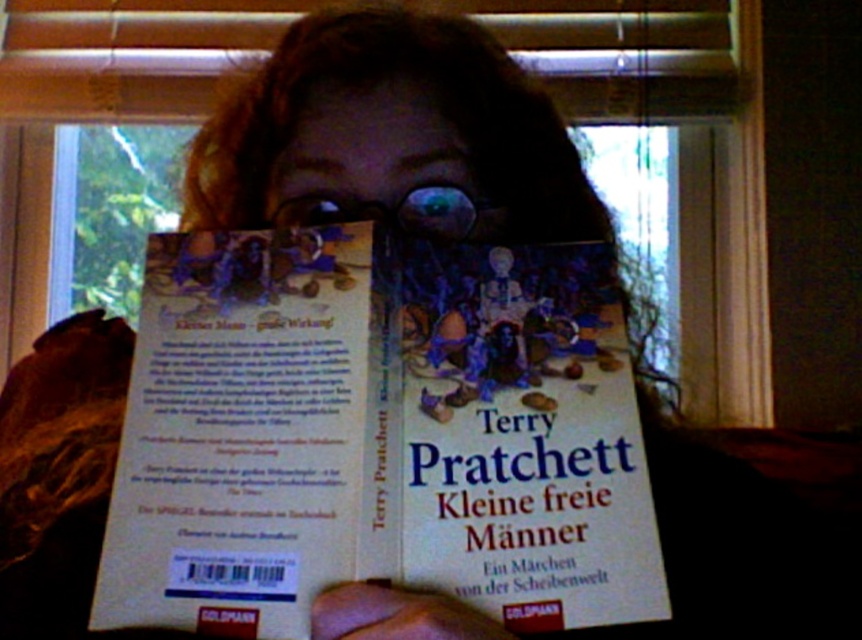
You are an assistant helping someone organize their desk. They have a white paper at center and a matte plastic face at center on their desk. Which object should they place in a wider drawer to ensure it fits properly?

The white paper at center should be placed in the wider drawer because its width is larger than the matte plastic face at center.

You are a photographer trying to capture the scene of the person holding the book. You notice two items in the center of your viewfinder, the white paper at center and the matte plastic face at center. Which object should you focus on to ensure it appears larger in the photo?

The white paper at center is much taller than the matte plastic face at center, so focusing on the white paper at center will ensure it appears larger in the photo.

You are an assistant who needs to locate the white paper at center in a scene where a person is holding a book titled

The white paper at center is located at coordinates point (378, 435).